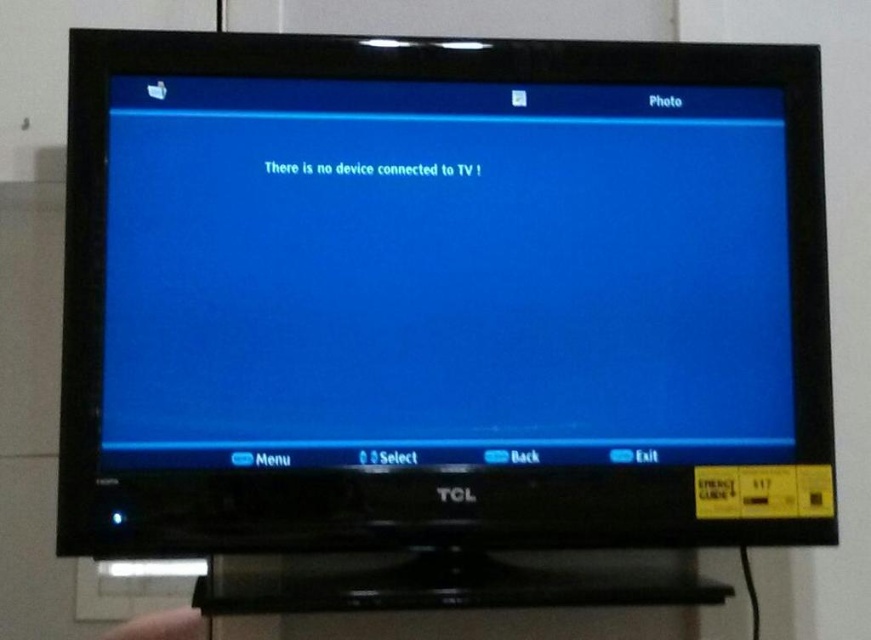
You are a technician trying to fix the TV. You need to reach the power button located at the bottom left corner of the blue glossy screen at center. You have a tool that is 18 inches long. Can you reach the power button with your tool from where your hand is currently placed at the skinny flesh hand at lower left?

The distance between the blue glossy screen at center and the skinny flesh hand at lower left is 22.05 inches. Since the tool is only 18 inches long, it is not long enough to reach the power button from that position.

You are a technician trying to fix a TV. You see the blue glossy screen at center and the skinny flesh hand at lower left. Which object is above the other?

The blue glossy screen at center is positioned over the skinny flesh hand at lower left, meaning it is above it.